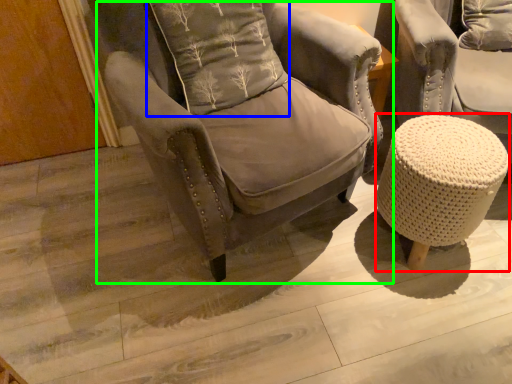
Question: Which object is positioned closest to bar stool (highlighted by a red box)? Select from pillow (highlighted by a blue box) and chair (highlighted by a green box).

Choices:
 (A) pillow
 (B) chair

Answer: (B)